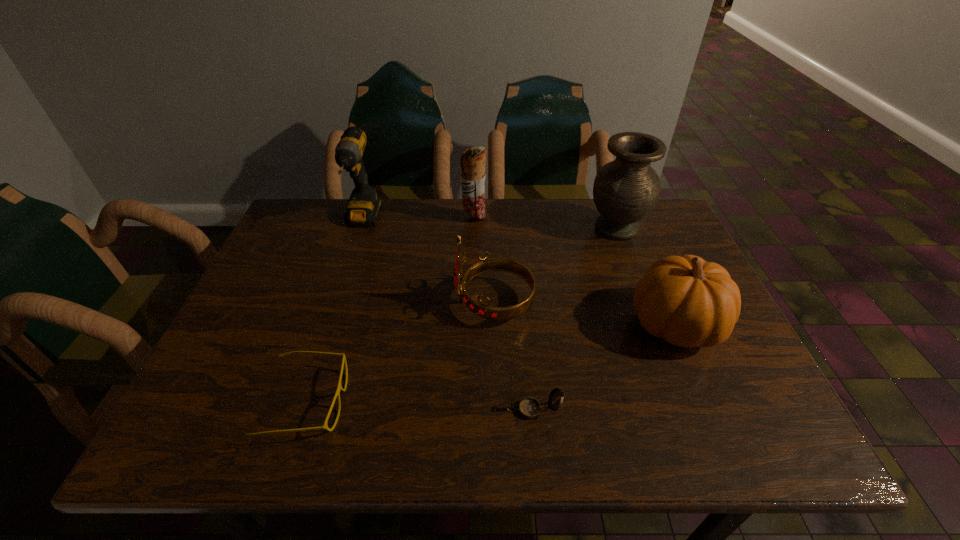
Identify the location of vacant space that is in between the burrito and the pumpkin. (574, 271).

The image size is (960, 540). I want to click on free space between the spectacles and the burrito, so click(390, 310).

This screenshot has height=540, width=960. Find the location of `the fifth closest object to the pumpkin`. the fifth closest object to the pumpkin is located at coordinates (339, 388).

Identify which object is located as the sixth nearest to the compass. Please provide its 2D coordinates. Your answer should be formatted as a tuple, i.e. [(x, y)], where the tuple contains the x and y coordinates of a point satisfying the conditions above.

[(364, 204)]

The width and height of the screenshot is (960, 540). I want to click on vacant area that satisfies the following two spatial constraints: 1. with the drill bit of the drill facing forward; 2. on the left side of the vase, so click(360, 228).

The image size is (960, 540). I want to click on free location that satisfies the following two spatial constraints: 1. on the back side of the pumpkin; 2. on the front-facing side of the tiara, so click(x=665, y=303).